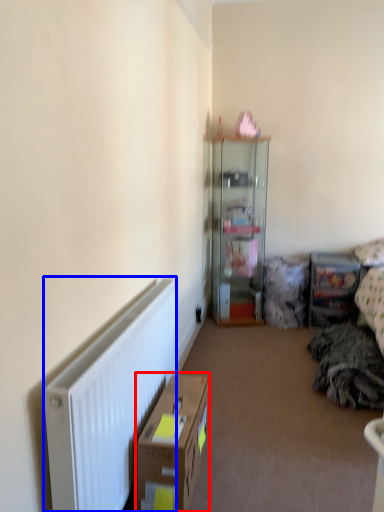
Question: Which object is further to the camera taking this photo, cardboard box (highlighted by a red box) or radiator (highlighted by a blue box)?

Choices:
 (A) cardboard box
 (B) radiator

Answer: (A)